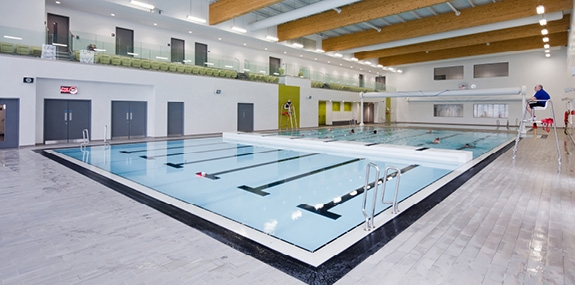
Locate an element on the screen. The width and height of the screenshot is (575, 285). doors is located at coordinates (79, 118), (137, 125), (179, 116), (250, 110), (275, 67), (198, 47), (181, 42), (131, 37), (61, 22).